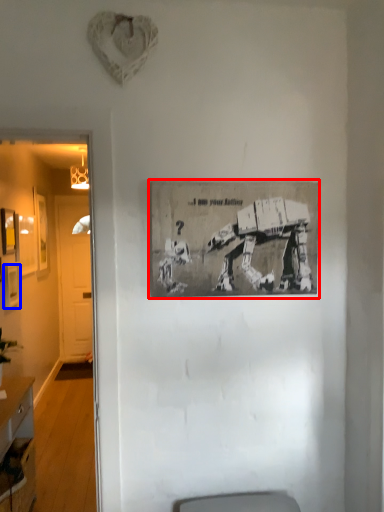
Question: Which point is further to the camera, picture frame (highlighted by a red box) or picture frame (highlighted by a blue box)?

Choices:
 (A) picture frame
 (B) picture frame

Answer: (B)